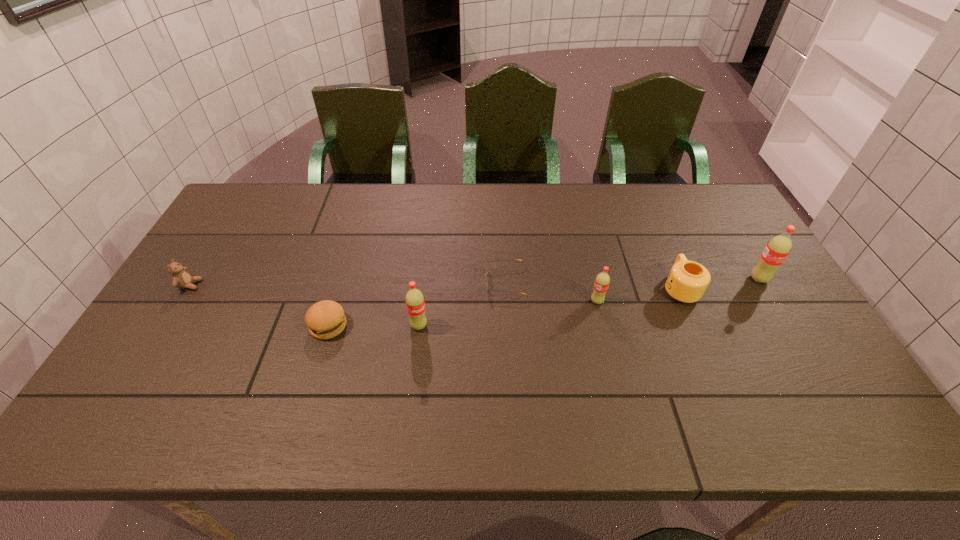
Image resolution: width=960 pixels, height=540 pixels. Identify the location of vacant space located 0.100m on the handle side of the sixth object from left to right. (662, 249).

The height and width of the screenshot is (540, 960). Identify the location of vacant space situated on the handle side of the sixth object from left to right. (647, 211).

I want to click on vacant area located on the handle side of the sixth object from left to right, so click(653, 226).

Where is `object that is at the left edge`? object that is at the left edge is located at coordinates (181, 278).

At what (x,y) coordinates should I click in order to perform the action: click on object present at the right edge. Please return your answer as a coordinate pair (x, y). The image size is (960, 540). Looking at the image, I should click on (x=777, y=249).

Image resolution: width=960 pixels, height=540 pixels. Identify the location of vacant space at the far edge of the desktop. (525, 207).

This screenshot has height=540, width=960. Identify the location of free space at the near edge of the desktop. (547, 394).

The image size is (960, 540). In the image, there is a desktop. Identify the location of vacant space at the left edge. (168, 326).

You are a GUI agent. You are given a task and a screenshot of the screen. Output one action in this format:
    pyautogui.click(x=<x>, y=<y>)
    Task: Click on the free space at the right edge of the desktop
    
    Given the screenshot: What is the action you would take?
    pyautogui.click(x=745, y=299)

The height and width of the screenshot is (540, 960). In the image, there is a desktop. Identify the location of vacant region at the far right corner. (683, 208).